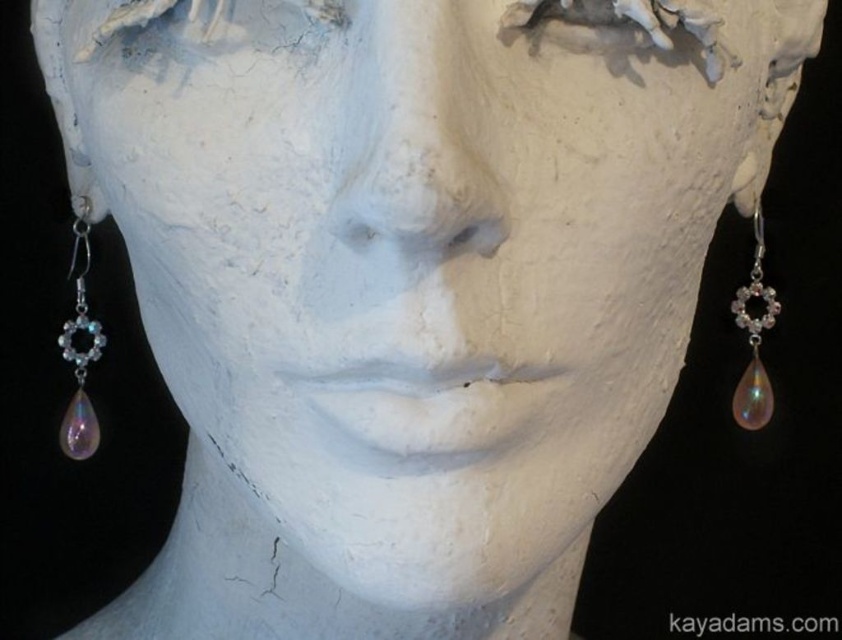
Consider the image. Does iridescent glass teardrop at left have a lesser width compared to iridescent glass teardrop at right?

Incorrect, iridescent glass teardrop at left's width is not less than iridescent glass teardrop at right's.

Which is behind, point (88, 250) or point (736, 392)?

The point (88, 250) is behind.

Where is `iridescent glass teardrop at left`? This screenshot has height=640, width=842. iridescent glass teardrop at left is located at coordinates (80, 348).